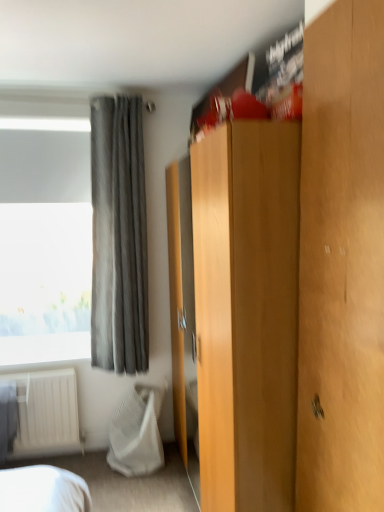
Describe the element at coordinates (119, 237) in the screenshot. This screenshot has width=384, height=512. I see `gray fabric curtain at upper left` at that location.

Where is `light brown wood dresser at center`? Image resolution: width=384 pixels, height=512 pixels. light brown wood dresser at center is located at coordinates (296, 284).

From their relative heights in the image, would you say gray fabric curtain at upper left is taller or shorter than wooden door at right?

Considering their sizes, gray fabric curtain at upper left has more height than wooden door at right.

Which object is wider, gray fabric curtain at upper left or wooden door at right?

gray fabric curtain at upper left is wider.

Considering the relative positions of light brown wood dresser at center and gray fabric curtain at upper left in the image provided, is light brown wood dresser at center behind gray fabric curtain at upper left?

That is False.

Does light brown wood dresser at center touch gray fabric curtain at upper left?

No, light brown wood dresser at center is not making contact with gray fabric curtain at upper left.

From a real-world perspective, is light brown wood dresser at center positioned under gray fabric curtain at upper left based on gravity?

Yes, from a real-world perspective, light brown wood dresser at center is beneath gray fabric curtain at upper left.

Is light brown wood dresser at center taller or shorter than gray fabric curtain at upper left?

Clearly, light brown wood dresser at center is taller compared to gray fabric curtain at upper left.

Considering the relative positions of white textured blanket at lower left and light brown wood dresser at center in the image provided, is white textured blanket at lower left to the right of light brown wood dresser at center from the viewer's perspective?

Incorrect, white textured blanket at lower left is not on the right side of light brown wood dresser at center.

How different are the orientations of white textured blanket at lower left and light brown wood dresser at center in degrees?

white textured blanket at lower left and light brown wood dresser at center are facing 94.4 degrees away from each other.

From the picture: Is white textured blanket at lower left aimed at light brown wood dresser at center?

No, white textured blanket at lower left is not turned towards light brown wood dresser at center.

Who is taller, white textured blanket at lower left or light brown wood dresser at center?

Standing taller between the two is light brown wood dresser at center.

Can gray fabric curtain at upper left be found inside wooden door at right?

No, gray fabric curtain at upper left is not surrounded by wooden door at right.

Between wooden door at right and gray fabric curtain at upper left, which one is positioned behind?

gray fabric curtain at upper left is behind.

Locate an element on the screen. The image size is (384, 512). door below the gray fabric curtain at upper left (from the image's perspective) is located at coordinates (342, 262).

Looking at this image, which of these two, wooden door at right or gray fabric curtain at upper left, stands shorter?

wooden door at right is shorter.

Considering the relative sizes of wooden door at right and white textured blanket at lower left in the image provided, is wooden door at right bigger than white textured blanket at lower left?

No.

Does wooden door at right appear on the left side of white textured blanket at lower left?

No, wooden door at right is not to the left of white textured blanket at lower left.

Is wooden door at right oriented away from white textured blanket at lower left?

No, wooden door at right is not facing the opposite direction of white textured blanket at lower left.

From the image's perspective, which one is positioned higher, wooden door at right or white textured blanket at lower left?

wooden door at right is shown above in the image.

From a real-world perspective, between white textured blanket at lower left and wooden door at right, who is vertically higher?

wooden door at right.

Choose the correct answer: Is white textured blanket at lower left inside wooden door at right or outside it?

The correct answer is: outside.

From their relative heights in the image, would you say white textured blanket at lower left is taller or shorter than wooden door at right?

white textured blanket at lower left is shorter than wooden door at right.

At what (x,y) coordinates should I click in order to perform the action: click on blanket on the left side of wooden door at right. Please return your answer as a coordinate pair (x, y). Looking at the image, I should click on (137, 432).

Is wooden door at right at the left side of light brown wood dresser at center?

In fact, wooden door at right is to the right of light brown wood dresser at center.

Is wooden door at right oriented towards light brown wood dresser at center?

No, wooden door at right is not turned towards light brown wood dresser at center.

Would you say wooden door at right is inside or outside light brown wood dresser at center?

wooden door at right cannot be found inside light brown wood dresser at center.

You are a GUI agent. You are given a task and a screenshot of the screen. Output one action in this format:
    pyautogui.click(x=<x>, y=<y>)
    Task: Click on the door in front of the gray fabric curtain at upper left
    The image size is (384, 512).
    Given the screenshot: What is the action you would take?
    pyautogui.click(x=342, y=262)

You are a GUI agent. You are given a task and a screenshot of the screen. Output one action in this format:
    pyautogui.click(x=<x>, y=<y>)
    Task: Click on the dresser that appears on the right of gray fabric curtain at upper left
    This screenshot has height=512, width=384.
    Given the screenshot: What is the action you would take?
    pyautogui.click(x=296, y=284)

Looking at the image, which one is located further to light brown wood dresser at center, white textured blanket at lower left or gray fabric curtain at upper left?

Based on the image, white textured blanket at lower left appears to be further to light brown wood dresser at center.

From the image, which object appears to be farther from white textured blanket at lower left, light brown wood dresser at center or gray fabric curtain at upper left?

light brown wood dresser at center.

From the image, which object appears to be nearer to light brown wood dresser at center, gray fabric curtain at upper left or wooden door at right?

Based on the image, wooden door at right appears to be nearer to light brown wood dresser at center.

Based on their spatial positions, is light brown wood dresser at center or wooden door at right further from white textured blanket at lower left?

wooden door at right is further to white textured blanket at lower left.

From the image, which object appears to be farther from gray fabric curtain at upper left, light brown wood dresser at center or white textured blanket at lower left?

light brown wood dresser at center is further to gray fabric curtain at upper left.

From the image, which object appears to be nearer to wooden door at right, gray fabric curtain at upper left or white textured blanket at lower left?

Based on the image, gray fabric curtain at upper left appears to be nearer to wooden door at right.

Looking at the image, which one is located further to wooden door at right, white textured blanket at lower left or light brown wood dresser at center?

white textured blanket at lower left.

Based on their spatial positions, is white textured blanket at lower left or wooden door at right closer to light brown wood dresser at center?

wooden door at right is positioned closer to the anchor light brown wood dresser at center.

You are a GUI agent. You are given a task and a screenshot of the screen. Output one action in this format:
    pyautogui.click(x=<x>, y=<y>)
    Task: Click on the curtain between wooden door at right and white textured blanket at lower left from front to back
    The height and width of the screenshot is (512, 384).
    Given the screenshot: What is the action you would take?
    [x=119, y=237]

The height and width of the screenshot is (512, 384). What are the coordinates of `curtain located between light brown wood dresser at center and white textured blanket at lower left in the depth direction` in the screenshot? It's located at (119, 237).

The image size is (384, 512). I want to click on dresser between wooden door at right and gray fabric curtain at upper left from front to back, so click(296, 284).

At what (x,y) coordinates should I click in order to perform the action: click on dresser between wooden door at right and white textured blanket at lower left along the z-axis. Please return your answer as a coordinate pair (x, y). Image resolution: width=384 pixels, height=512 pixels. Looking at the image, I should click on (x=296, y=284).